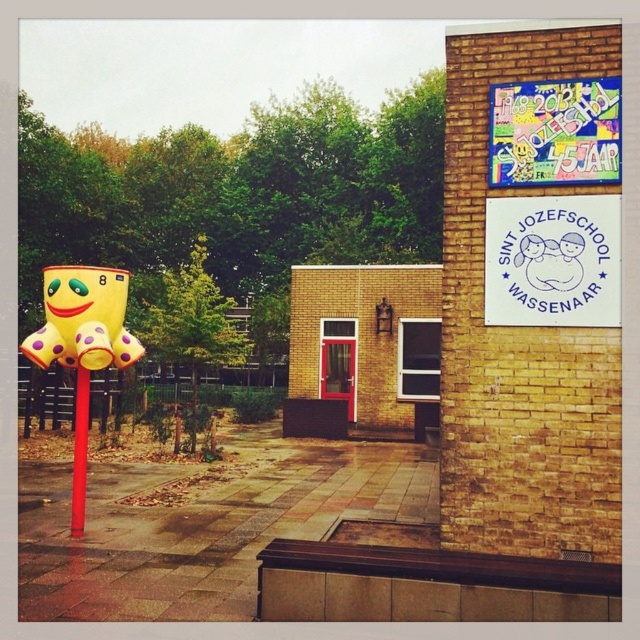
Question: Among these points, which one is farthest from the camera?

Choices:
 (A) (516, 116)
 (B) (83, 474)
 (C) (576, 248)

Answer: (B)

Question: Does yellow rubber duck at left lie behind smooth white face at upper right?

Choices:
 (A) no
 (B) yes

Answer: (B)

Question: Which point appears farthest from the camera in this image?

Choices:
 (A) (56, 317)
 (B) (504, 234)
 (C) (554, 99)
 (D) (84, 460)

Answer: (D)

Question: Does yellow rubber toy at left appear under smooth white face at upper right?

Choices:
 (A) yes
 (B) no

Answer: (A)

Question: Which is nearer to the white paper sign at upper right?

Choices:
 (A) vibrant paper poster at upper right
 (B) yellow rubber duck at left
 (C) yellow rubber toy at left

Answer: (A)

Question: Can you confirm if white paper sign at upper right is wider than vibrant paper poster at upper right?

Choices:
 (A) yes
 (B) no

Answer: (A)